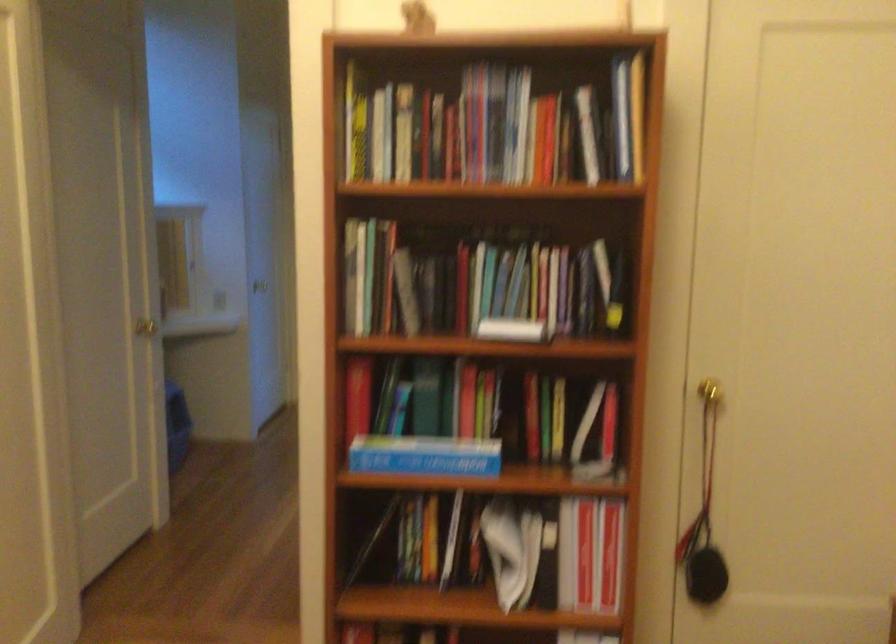
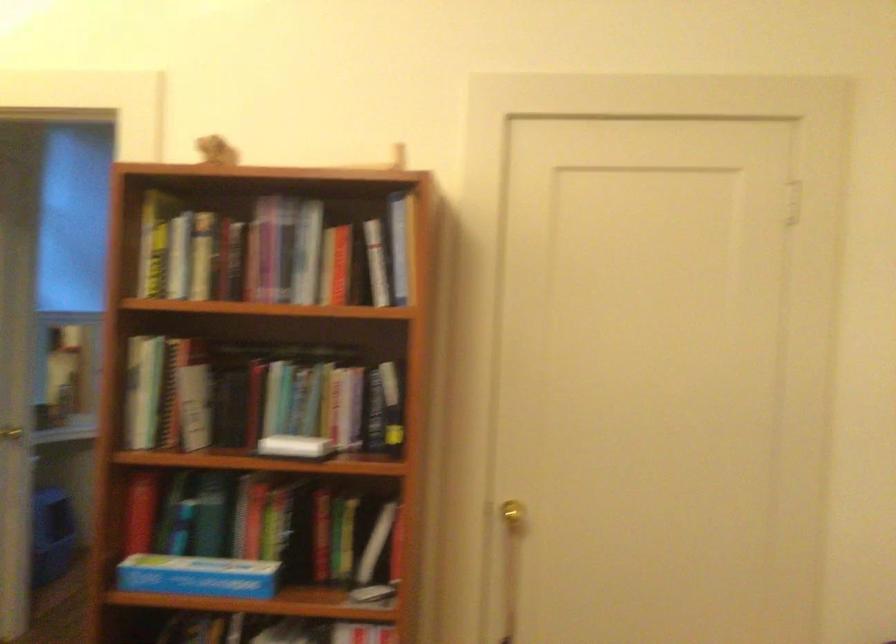
Question: How did the camera likely rotate?

Choices:
 (A) Left
 (B) Right
 (C) Up
 (D) Down

Answer: (C)